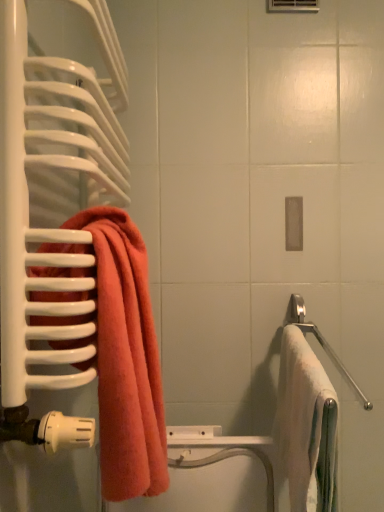
Question: Relative to white soft towel at right, the first towel from the right, is satin silver towel bar at right in front or behind?

Choices:
 (A) behind
 (B) front

Answer: (A)

Question: From the image's perspective, is satin silver towel bar at right above or below white soft towel at right, the first towel from the right?

Choices:
 (A) below
 (B) above

Answer: (B)

Question: Which object is positioned farthest from the coral terry towel at left, the 2th towel in the right-to-left sequence?

Choices:
 (A) white soft towel at right, the first towel from the right
 (B) satin silver towel bar at right

Answer: (B)

Question: Which object is positioned farthest from the white soft towel at right, the first towel from the right?

Choices:
 (A) coral terry towel at left, arranged as the first towel when viewed from the left
 (B) satin silver towel bar at right

Answer: (A)